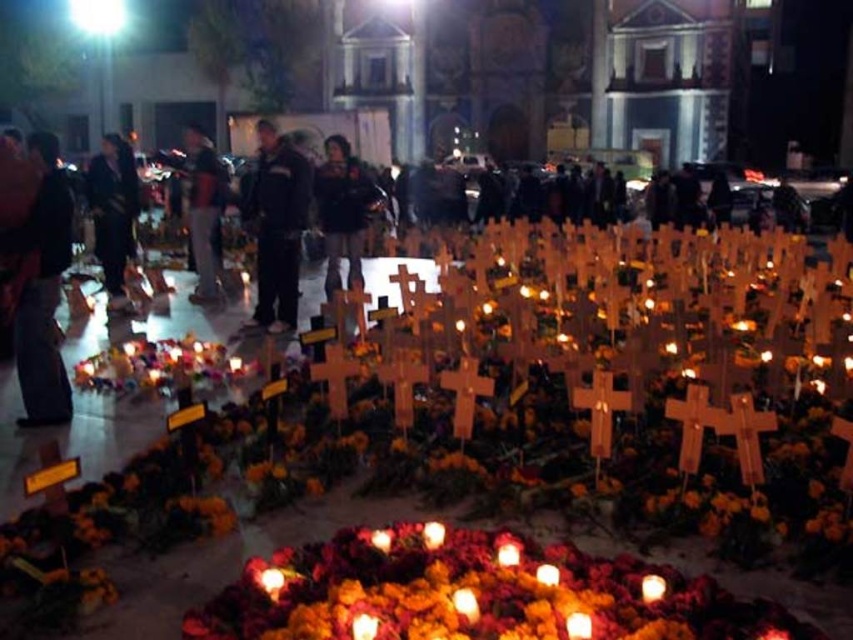
Who is higher up, dark blue jacket at left or dark blue jeans at center?

dark blue jeans at center is above.

Between dark blue jacket at left and dark blue jeans at center, which one appears on the left side from the viewer's perspective?

Positioned to the left is dark blue jeans at center.

The width and height of the screenshot is (853, 640). What are the coordinates of `dark blue jacket at left` in the screenshot? It's located at (113, 212).

The width and height of the screenshot is (853, 640). I want to click on dark blue jacket at left, so click(113, 212).

Between point (328, 172) and point (115, 253), which one is positioned in front?

Positioned in front is point (115, 253).

Is dark brown leather jacket at center above dark blue jacket at left?

Indeed, dark brown leather jacket at center is positioned over dark blue jacket at left.

Does point (322, 214) come farther from viewer compared to point (125, 152)?

No, it is not.

Find the location of a particular element. Image resolution: width=853 pixels, height=640 pixels. dark brown leather jacket at center is located at coordinates (341, 209).

Based on the photo, which is more to the left, dark blue jeans at left or dark blue jacket at left?

dark blue jacket at left

Who is positioned more to the right, dark blue jeans at left or dark blue jacket at left?

From the viewer's perspective, dark blue jeans at left appears more on the right side.

Which is in front, point (45, 417) or point (123, 273)?

Point (45, 417) is in front.

In order to click on dark blue jeans at left in this screenshot , I will do `click(41, 288)`.